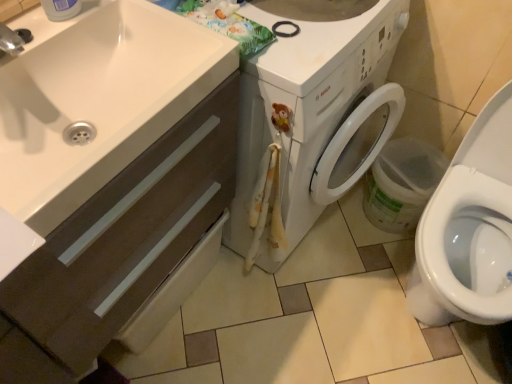
Question: Considering the relative sizes of white glossy sink at lower left and matte brown cabinet at lower left in the image provided, is white glossy sink at lower left taller than matte brown cabinet at lower left?

Choices:
 (A) yes
 (B) no

Answer: (B)

Question: Is the depth of white glossy sink at lower left greater than that of matte brown cabinet at lower left?

Choices:
 (A) no
 (B) yes

Answer: (B)

Question: Is the depth of white glossy sink at lower left less than that of matte brown cabinet at lower left?

Choices:
 (A) no
 (B) yes

Answer: (A)

Question: Considering the relative positions of white glossy sink at lower left and matte brown cabinet at lower left in the image provided, is white glossy sink at lower left to the left of matte brown cabinet at lower left from the viewer's perspective?

Choices:
 (A) no
 (B) yes

Answer: (A)

Question: Does white glossy sink at lower left have a lesser width compared to matte brown cabinet at lower left?

Choices:
 (A) no
 (B) yes

Answer: (A)

Question: Is point (139, 180) positioned closer to the camera than point (185, 100)?

Choices:
 (A) closer
 (B) farther

Answer: (A)

Question: Considering the positions of matte brown cabinet at lower left and white glossy sink at lower left in the image, is matte brown cabinet at lower left taller or shorter than white glossy sink at lower left?

Choices:
 (A) tall
 (B) short

Answer: (A)

Question: From the image's perspective, is matte brown cabinet at lower left positioned above or below white glossy sink at lower left?

Choices:
 (A) below
 (B) above

Answer: (A)

Question: Is matte brown cabinet at lower left in front of or behind white glossy sink at lower left in the image?

Choices:
 (A) front
 (B) behind

Answer: (A)

Question: Do you think white glossy sink at lower left is within matte brown cabinet at lower left, or outside of it?

Choices:
 (A) outside
 (B) inside

Answer: (B)

Question: Looking at their shapes, would you say white glossy sink at lower left is wider or thinner than matte brown cabinet at lower left?

Choices:
 (A) thin
 (B) wide

Answer: (B)

Question: From their relative heights in the image, would you say white glossy sink at lower left is taller or shorter than matte brown cabinet at lower left?

Choices:
 (A) short
 (B) tall

Answer: (A)

Question: From a real-world perspective, relative to matte brown cabinet at lower left, is white glossy sink at lower left vertically above or below?

Choices:
 (A) below
 (B) above

Answer: (B)

Question: From the image's perspective, is white glossy washing machine at center above or below white glossy toilet at lower right?

Choices:
 (A) below
 (B) above

Answer: (B)

Question: Is white glossy washing machine at center situated inside white glossy toilet at lower right or outside?

Choices:
 (A) inside
 (B) outside

Answer: (B)